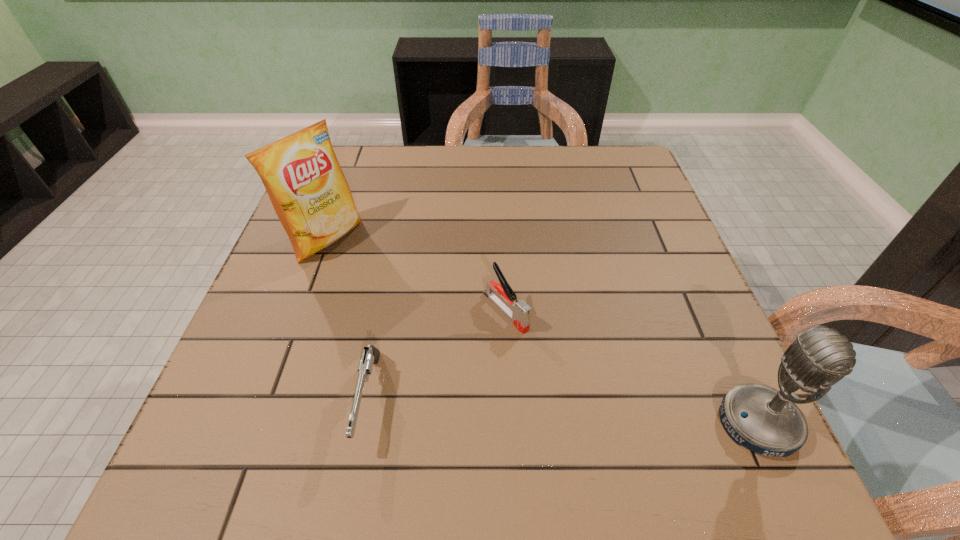
This screenshot has width=960, height=540. What are the coordinates of `vacant space that's between the third object from right to left and the microphone` in the screenshot? It's located at [x=564, y=411].

Locate an element on the screen. Image resolution: width=960 pixels, height=540 pixels. unoccupied area between the crisp (potato chip) and the shortest object is located at coordinates (348, 319).

Locate an element on the screen. empty location between the rightmost object and the second object from left to right is located at coordinates (564, 411).

Image resolution: width=960 pixels, height=540 pixels. Identify the location of free point between the microphone and the stapler. (632, 367).

Identify which object is the third closest to the third nearest object. Please provide its 2D coordinates. Your answer should be formatted as a tuple, i.e. [(x, y)], where the tuple contains the x and y coordinates of a point satisfying the conditions above.

[(764, 420)]

The width and height of the screenshot is (960, 540). In order to click on the third closest object to the rightmost object in this screenshot , I will do point(301,174).

I want to click on free spot that satisfies the following two spatial constraints: 1. on the front-facing side of the pistol; 2. on the front-facing side of the microphone, so click(364, 424).

The width and height of the screenshot is (960, 540). I want to click on vacant region that satisfies the following two spatial constraints: 1. on the front-facing side of the rightmost object; 2. on the front-facing side of the second object from left to right, so click(x=364, y=424).

Find the location of a particular element. vacant point that satisfies the following two spatial constraints: 1. on the front-facing side of the pistol; 2. on the front-facing side of the microphone is located at coordinates (364, 424).

Find the location of a particular element. The height and width of the screenshot is (540, 960). free region that satisfies the following two spatial constraints: 1. on the front-facing side of the pistol; 2. on the front-facing side of the microphone is located at coordinates (364, 424).